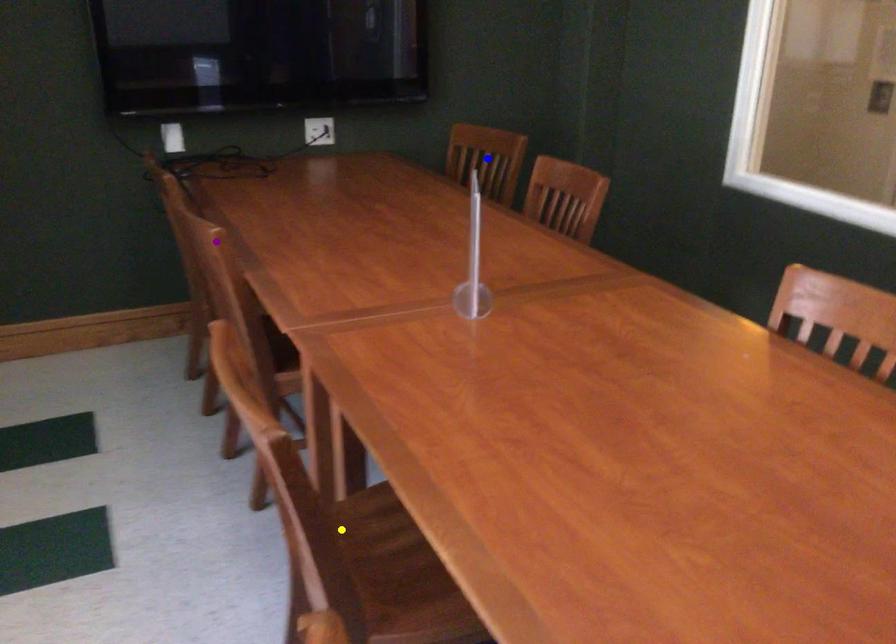
Order these from farthest to nearest:
blue point
purple point
yellow point

blue point → purple point → yellow point